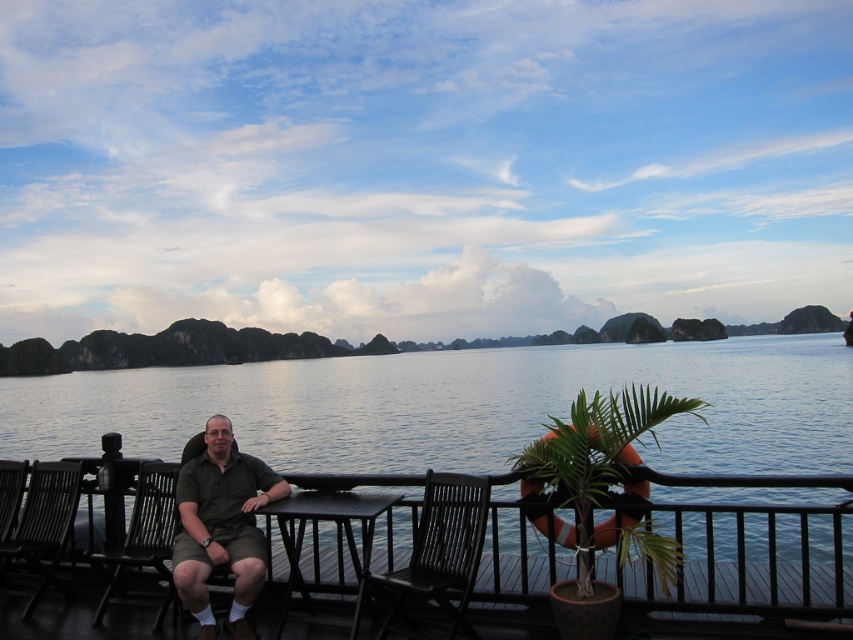
Question: Is green matte shirt at center to the left of black wood chair at center from the viewer's perspective?

Choices:
 (A) yes
 (B) no

Answer: (A)

Question: Can you confirm if black wood chair at center is smaller than black wood chair at left?

Choices:
 (A) no
 (B) yes

Answer: (A)

Question: Which object is the closest to the black wood chair at center?

Choices:
 (A) black wood rail at center
 (B) black plastic chair at lower left

Answer: (A)

Question: Is green matte shirt at center above black wood chair at left?

Choices:
 (A) no
 (B) yes

Answer: (B)

Question: Which point is closer to the camera?

Choices:
 (A) green matte shirt at center
 (B) black plastic chair at lower left

Answer: (A)

Question: Estimate the real-world distances between objects in this image. Which object is closer to the black wood chair at center?

Choices:
 (A) black wood chair at left
 (B) black wood rail at center
 (C) green matte shirt at center
 (D) black plastic chair at lower left

Answer: (B)